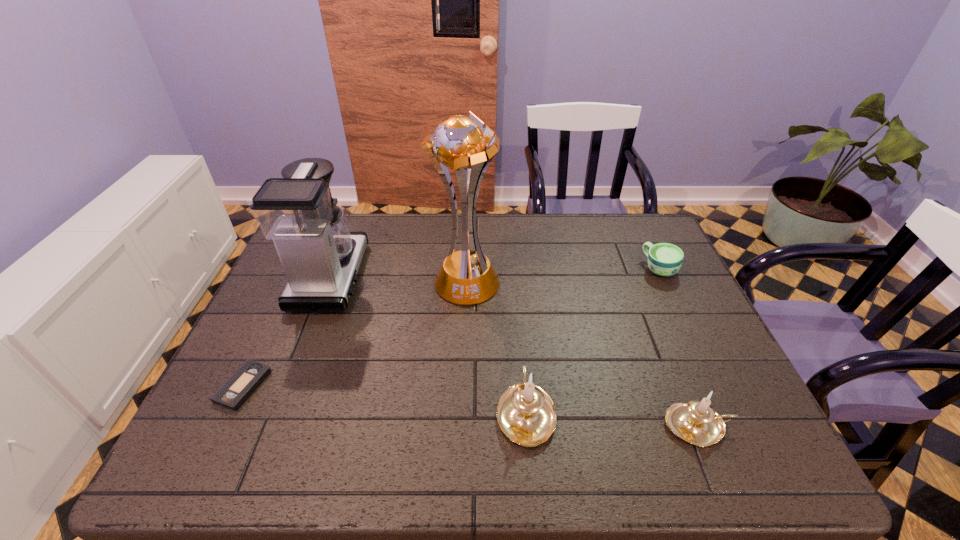
Locate an element on the screen. object that is the second closest to the trophy is located at coordinates (525, 413).

You are a GUI agent. You are given a task and a screenshot of the screen. Output one action in this format:
    pyautogui.click(x=<x>, y=<y>)
    Task: Click on the free location that satisfies the following two spatial constraints: 1. on the front side of the cup; 2. at the front of the coffee maker where the controls are located
    
    Given the screenshot: What is the action you would take?
    pyautogui.click(x=663, y=277)

This screenshot has height=540, width=960. Find the location of `vacant space that satisfies the following two spatial constraints: 1. on the handle side of the cup; 2. on the left side of the left candle holder`. vacant space that satisfies the following two spatial constraints: 1. on the handle side of the cup; 2. on the left side of the left candle holder is located at coordinates pos(513,269).